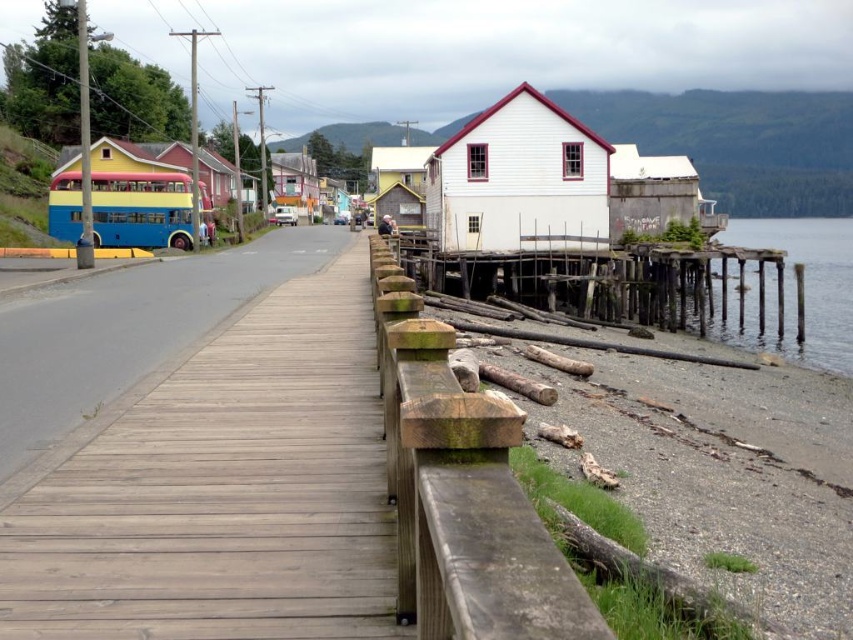
Question: Is white wood house at center further to the viewer compared to pink wood house at center?

Choices:
 (A) no
 (B) yes

Answer: (A)

Question: Does wooden planks at center appear on the right side of pink wood house at center?

Choices:
 (A) yes
 (B) no

Answer: (A)

Question: Which point is farther to the camera?

Choices:
 (A) white wood house at center
 (B) transparent wooden pier at lower right
 (C) wooden planks at center

Answer: (A)

Question: Is transparent wooden pier at lower right below pink wood house at center?

Choices:
 (A) yes
 (B) no

Answer: (A)

Question: Among these objects, which one is farthest from the camera?

Choices:
 (A) white wood house at center
 (B) pink wood house at center
 (C) wooden planks at center
 (D) transparent wooden pier at lower right

Answer: (B)

Question: Which object appears farthest from the camera in this image?

Choices:
 (A) transparent wooden pier at lower right
 (B) wooden planks at center
 (C) pink wood house at center

Answer: (C)